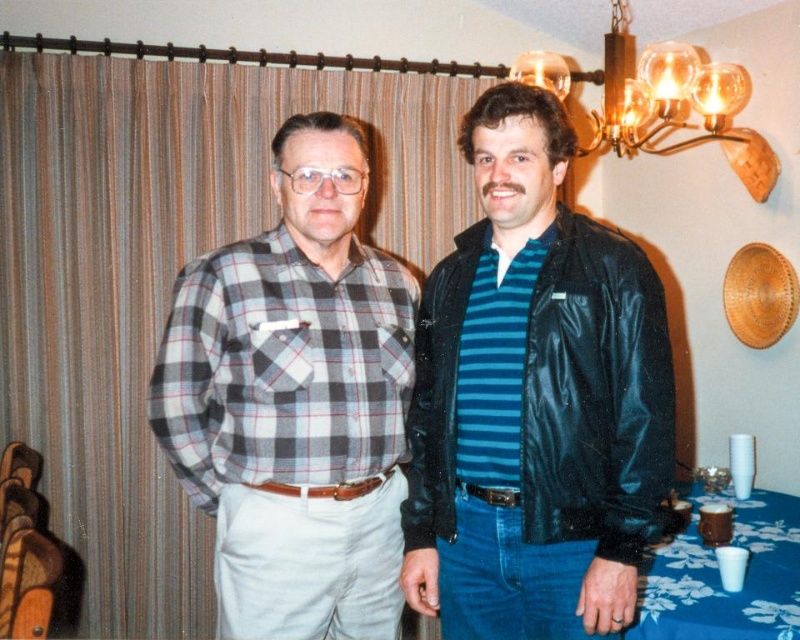
Is the position of plaid flannel shirt at center less distant than that of plaid cotton shirt at center?

Yes, plaid flannel shirt at center is in front of plaid cotton shirt at center.

Is point (566, 387) positioned before point (252, 596)?

Yes, it is in front of point (252, 596).

Find the location of a particular element. This screenshot has height=640, width=800. plaid flannel shirt at center is located at coordinates (536, 401).

Image resolution: width=800 pixels, height=640 pixels. I want to click on blue floral tablecloth at lower right, so click(720, 576).

Based on the photo, does blue floral tablecloth at lower right lie behind gold metallic chandelier at upper center?

No.

Is point (742, 532) in front of point (680, 88)?

Yes, point (742, 532) is in front of point (680, 88).

Identify the location of blue floral tablecloth at lower right. The height and width of the screenshot is (640, 800). (720, 576).

Which is more to the right, plaid cotton shirt at center or black shiny leather jacket at right?

From the viewer's perspective, black shiny leather jacket at right appears more on the right side.

This screenshot has width=800, height=640. What do you see at coordinates (296, 401) in the screenshot? I see `plaid cotton shirt at center` at bounding box center [296, 401].

Find the location of a particular element. This screenshot has width=800, height=640. plaid cotton shirt at center is located at coordinates pos(296,401).